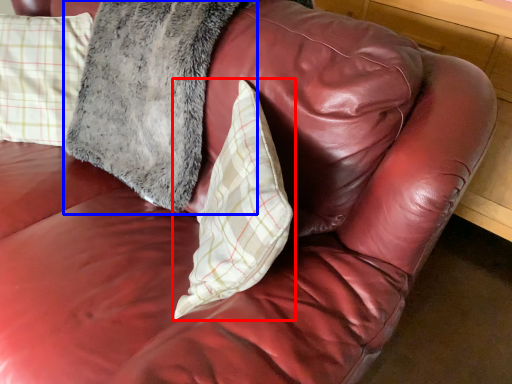
Question: Among these objects, which one is farthest to the camera, pillow (highlighted by a red box) or pillow (highlighted by a blue box)?

Choices:
 (A) pillow
 (B) pillow

Answer: (B)